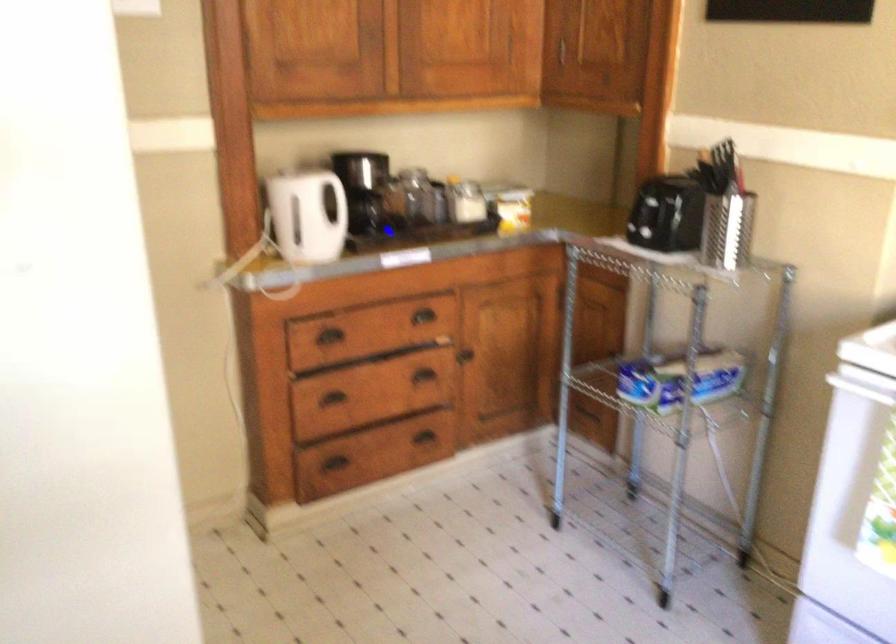
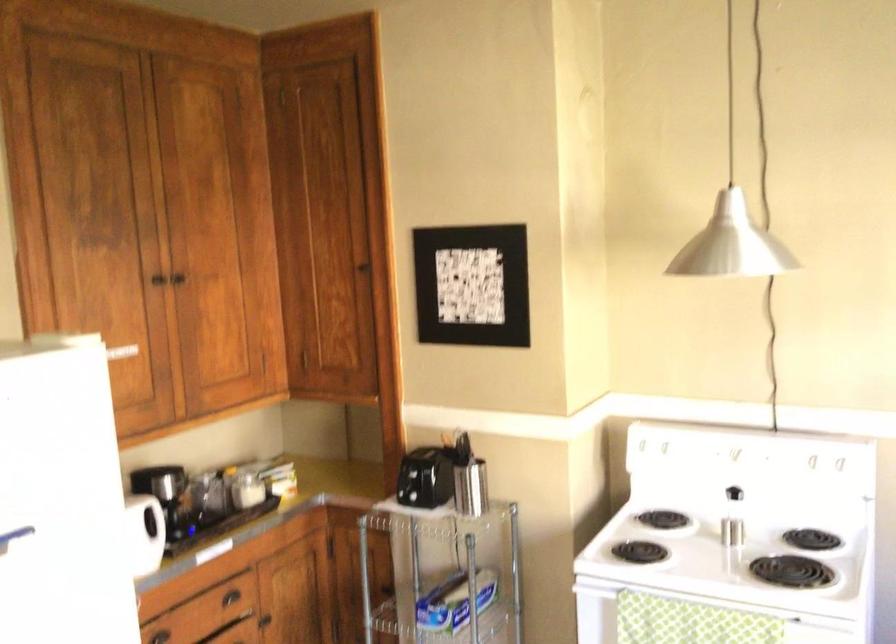
Question: The first image is from the beginning of the video and the second image is from the end. How did the camera likely rotate when shooting the video?

Choices:
 (A) Left
 (B) Right
 (C) Up
 (D) Down

Answer: (B)